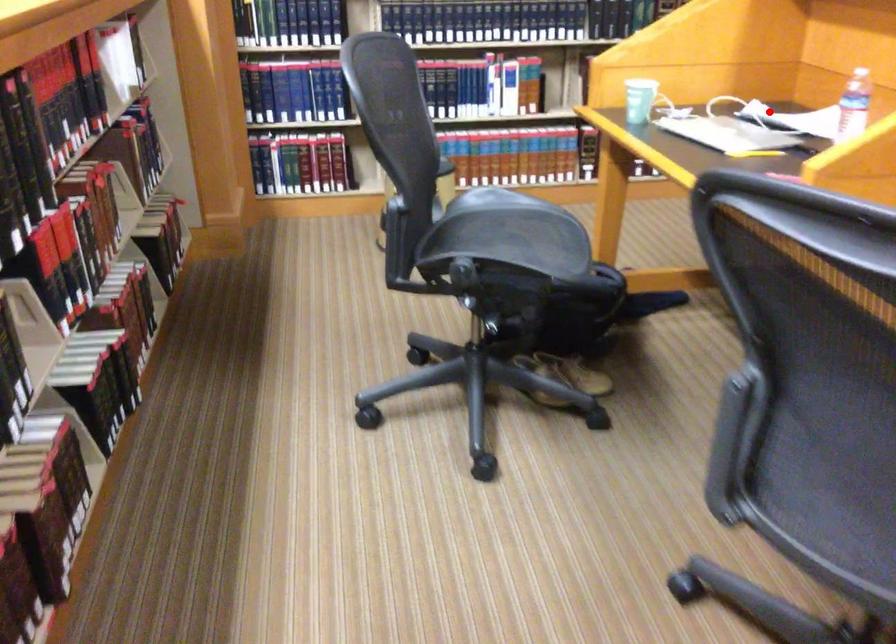
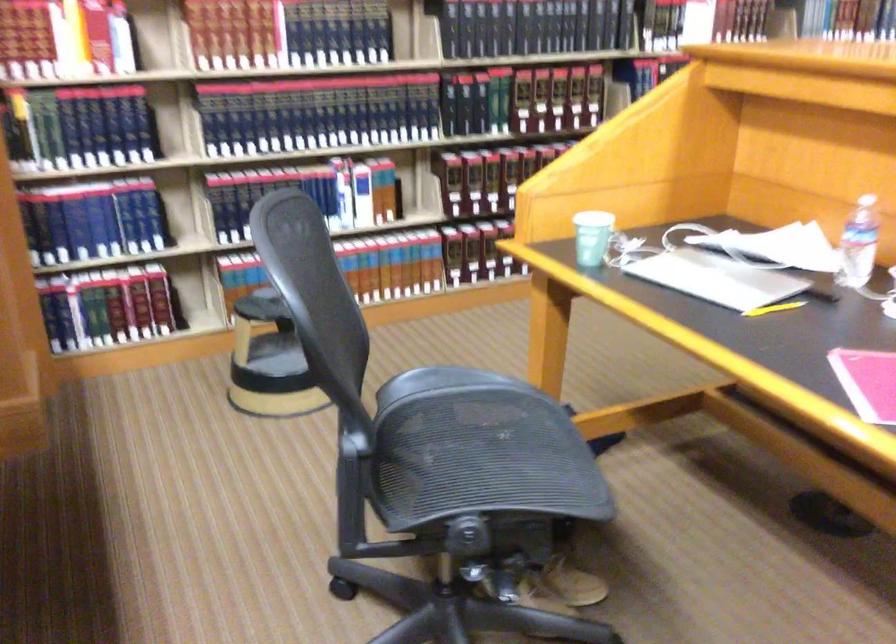
Question: A red point is marked in image1. In image2, is the corresponding 3D point closer to the camera or farther? Reply with the corresponding letter.

Choices:
 (A) The corresponding 3D point is closer.
 (B) The corresponding 3D point is farther.

Answer: (A)